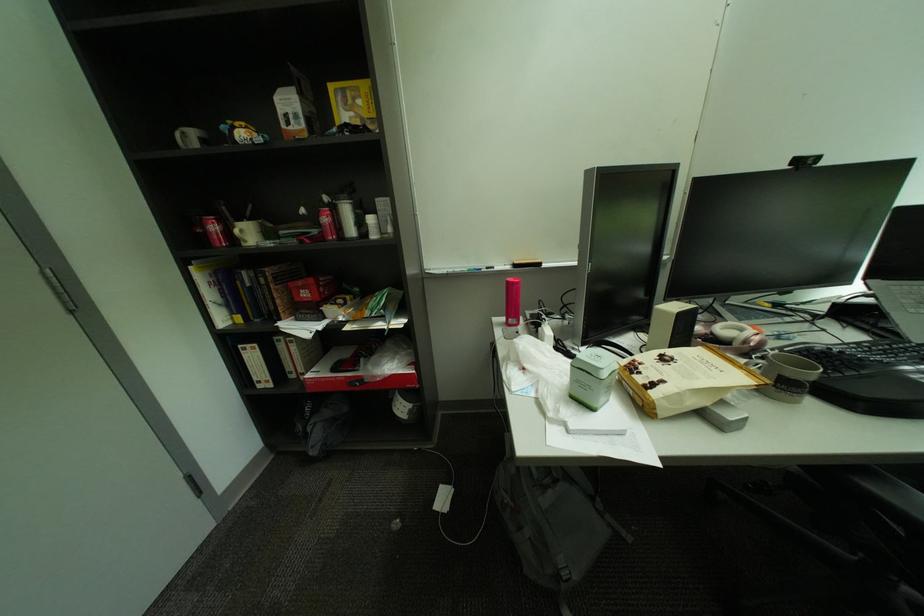
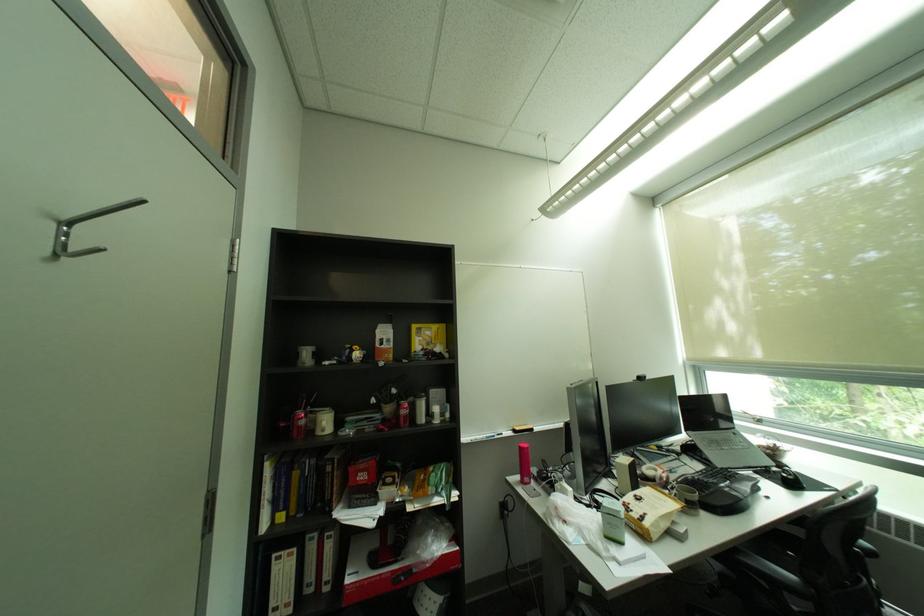
Find the pixel in the second image that matches (x=869, y=345) in the first image.

(712, 472)